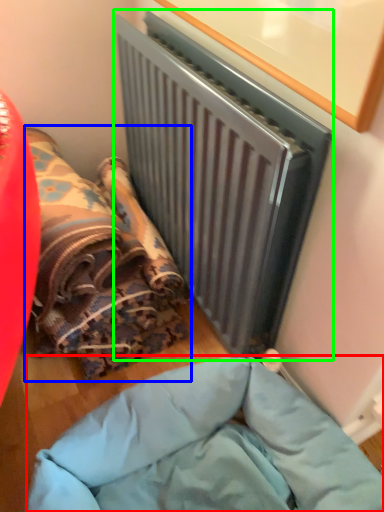
Question: Which is nearer to the furniture (highlighted by a red box)? bean bag chair (highlighted by a blue box) or radiator (highlighted by a green box).

Choices:
 (A) bean bag chair
 (B) radiator

Answer: (A)